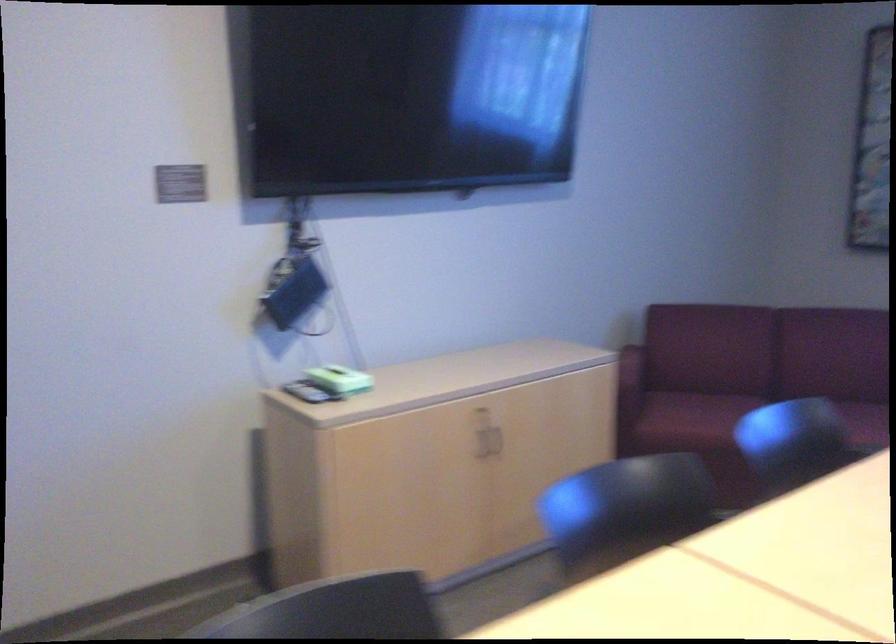
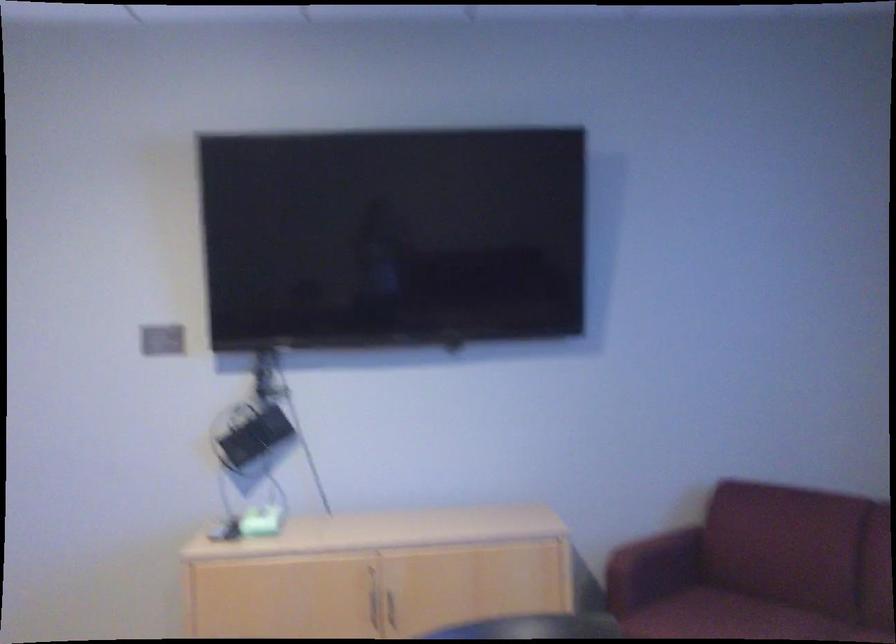
Locate, in the second image, the point that corresponds to pixel 714 406 in the first image.

(722, 616)